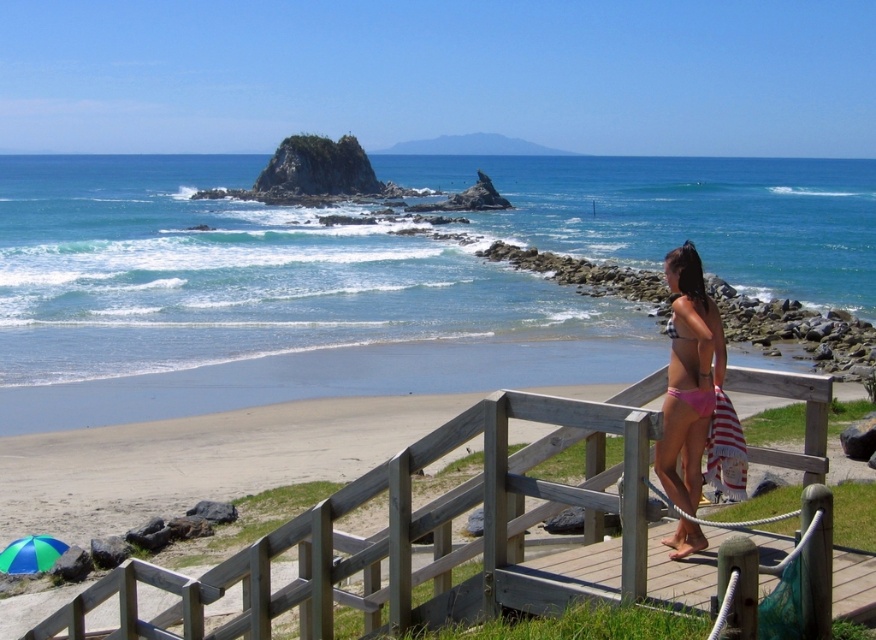
You are a lifeguard on duty at the beach. You notice a swimmer in trouble 10 meters away from the pink bikini at center. Can you reach the swimmer before they drift further away if you start from the green fabric umbrella at lower left?

The distance between the pink bikini at center and the green fabric umbrella at lower left is 8.59 meters. Since the swimmer is 10 meters away from the pink bikini, the total distance you need to cover is 8.59 meters plus 10 meters, totaling 18.59 meters. Lifeguards typically need to reach swimmers within 20 meters for a timely rescue, so you can reach the swimmer in time.

You are planning to set up a small table for two on the wooden walkway. The table requires a space of 1.5 meters in length. Given the presence of the wooden at center and the green fabric umbrella at lower left, can you determine if there is enough space between them to place the table?

The wooden at center has a larger size compared to the green fabric umbrella at lower left. However, without specific measurements of the distance between them, it is uncertain if the 1.5 meters required for the table is available. Check the actual spacing between the wooden at center and the green fabric umbrella at lower left before deciding.